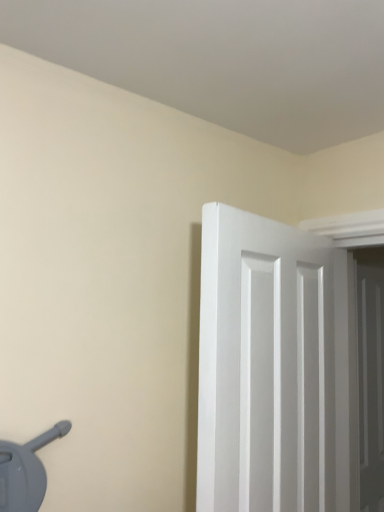
Question: Is white wooden door at right, positioned as the first door in back-to-front order, bigger or smaller than white smooth door at right, the second door in the back-to-front sequence?

Choices:
 (A) big
 (B) small

Answer: (B)

Question: In terms of height, does white wooden door at right, the first door from the right, look taller or shorter compared to white smooth door at right, the second door in the back-to-front sequence?

Choices:
 (A) short
 (B) tall

Answer: (B)

Question: In the image, is white wooden door at right, the first door from the right, on the left side or the right side of white smooth door at right, the second door in the back-to-front sequence?

Choices:
 (A) left
 (B) right

Answer: (B)

Question: From the image's perspective, relative to white wooden door at right, the first door from the right, is white smooth door at right, which is the first door from left to right, above or below?

Choices:
 (A) above
 (B) below

Answer: (A)

Question: Choose the correct answer: Is white smooth door at right, the first door from the front, inside white wooden door at right, the first door from the right, or outside it?

Choices:
 (A) inside
 (B) outside

Answer: (B)

Question: Is white smooth door at right, the second door viewed from the right, bigger or smaller than white wooden door at right, which is the 2th door in front-to-back order?

Choices:
 (A) small
 (B) big

Answer: (B)

Question: In terms of width, does white smooth door at right, the second door in the back-to-front sequence, look wider or thinner when compared to white wooden door at right, which is the 2th door in front-to-back order?

Choices:
 (A) wide
 (B) thin

Answer: (A)